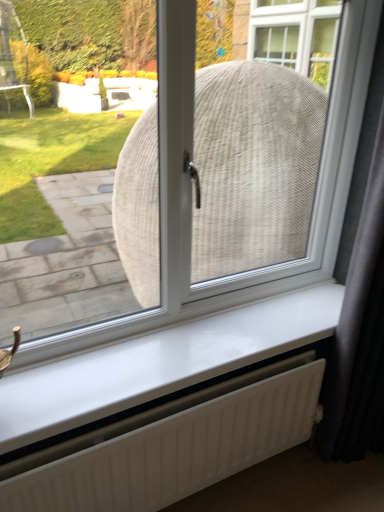
Question: From a real-world perspective, is black fabric curtain at right above or below white glossy window sill at center?

Choices:
 (A) above
 (B) below

Answer: (A)

Question: From the image's perspective, relative to white glossy window sill at center, is black fabric curtain at right above or below?

Choices:
 (A) above
 (B) below

Answer: (A)

Question: Which object is the closest to the white glossy window sill at center?

Choices:
 (A) black fabric curtain at right
 (B) white matte radiator at lower center

Answer: (B)

Question: Which object is the closest to the black fabric curtain at right?

Choices:
 (A) white matte radiator at lower center
 (B) white glossy window sill at center

Answer: (B)